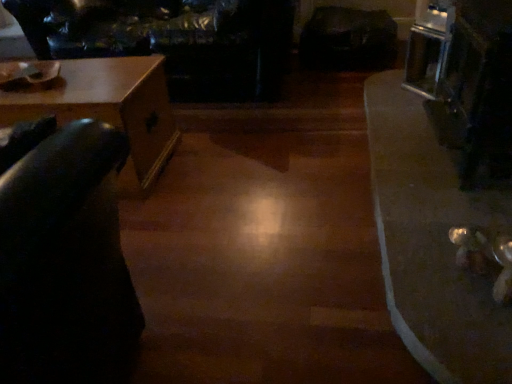
In order to click on vacant area that is in front of leather couch at upper left in this screenshot , I will do `click(249, 173)`.